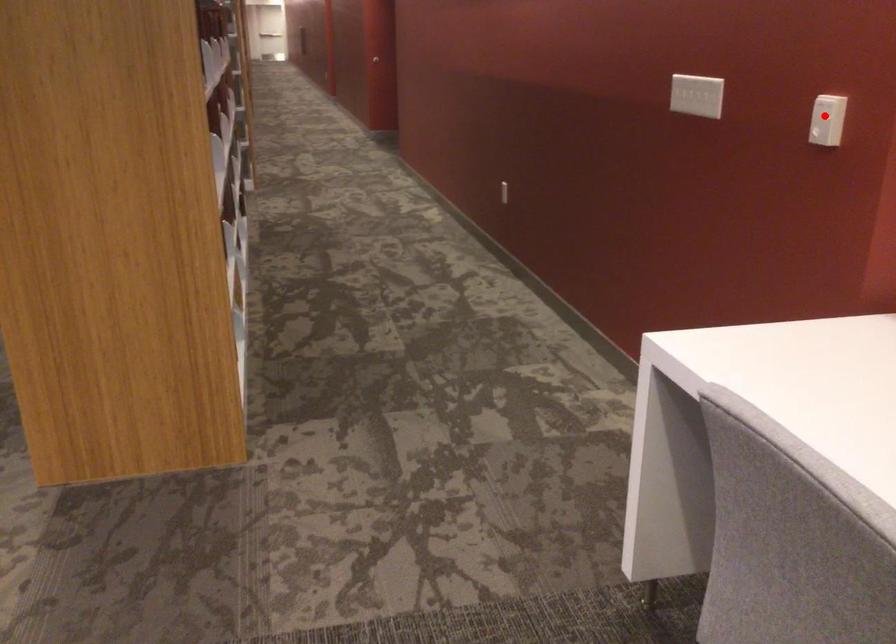
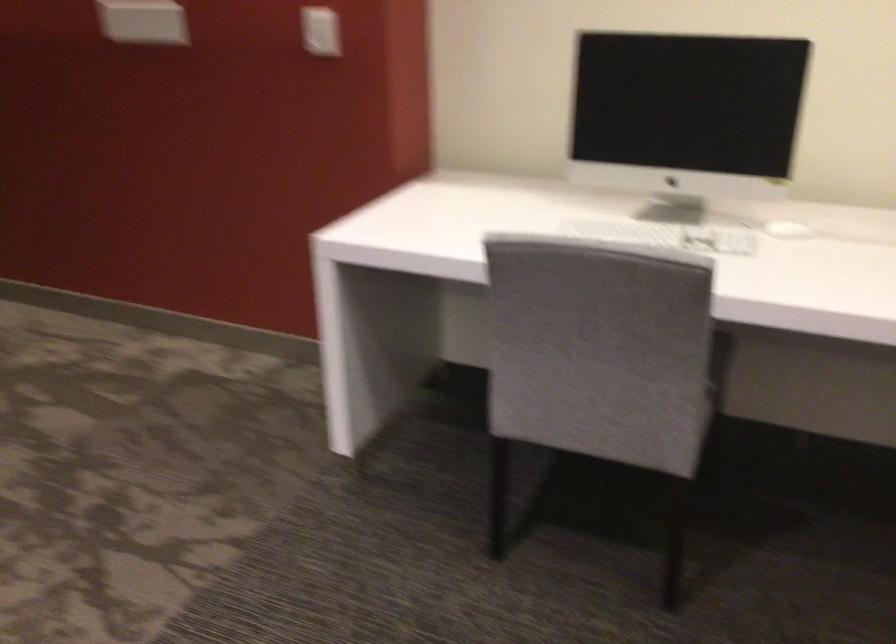
Question: I am providing you with two images of the same scene from different viewpoints. Image1 has a red point marked. In image2, the corresponding 3D location appears at what relative position? Reply with the corresponding letter.

Choices:
 (A) Closer
 (B) Farther

Answer: (B)